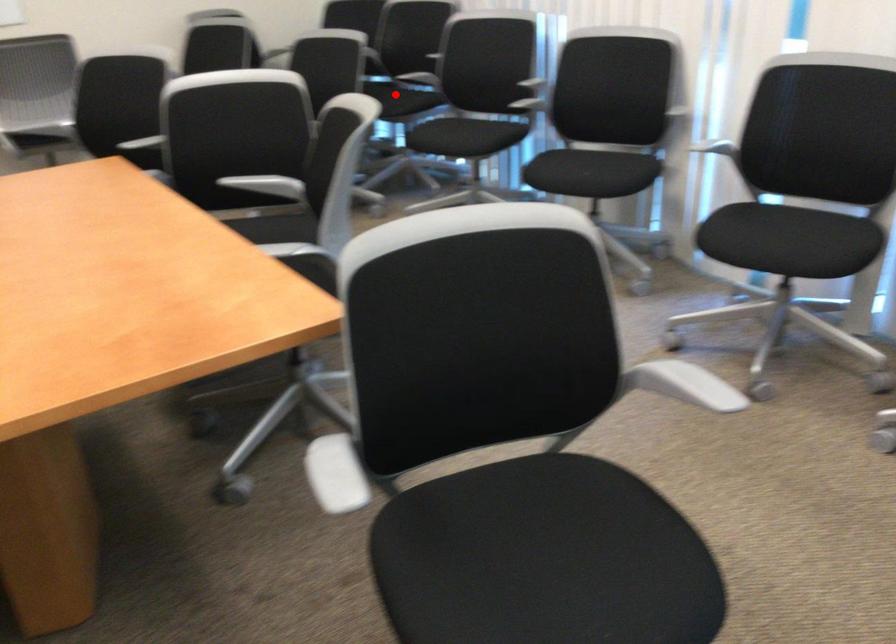
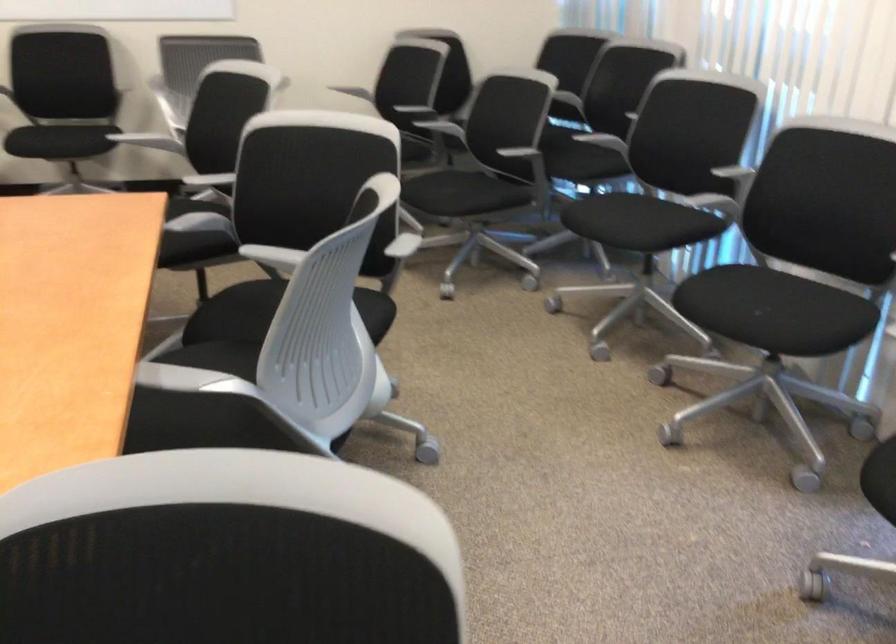
The point at the highlighted location is marked in the first image. Where is the corresponding point in the second image?

(588, 147)